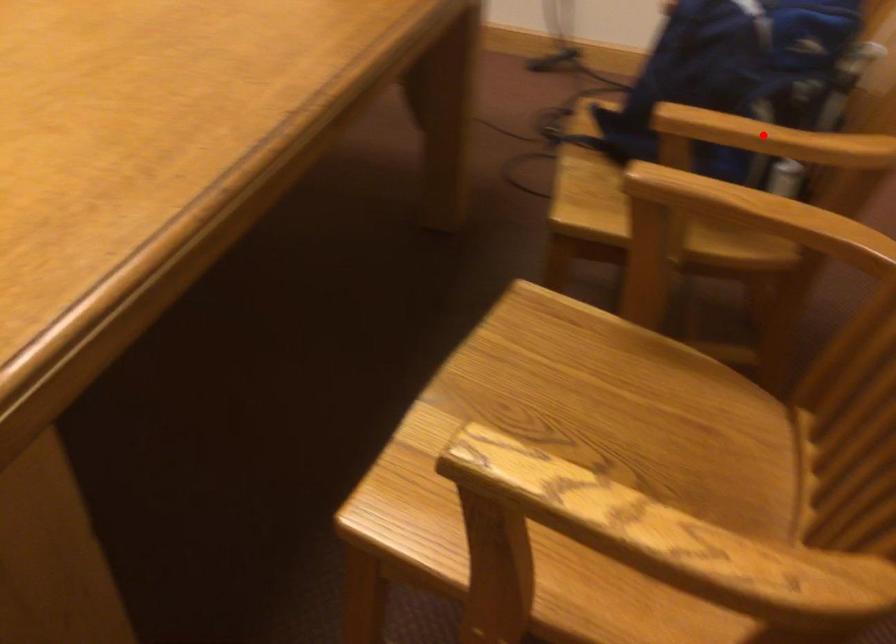
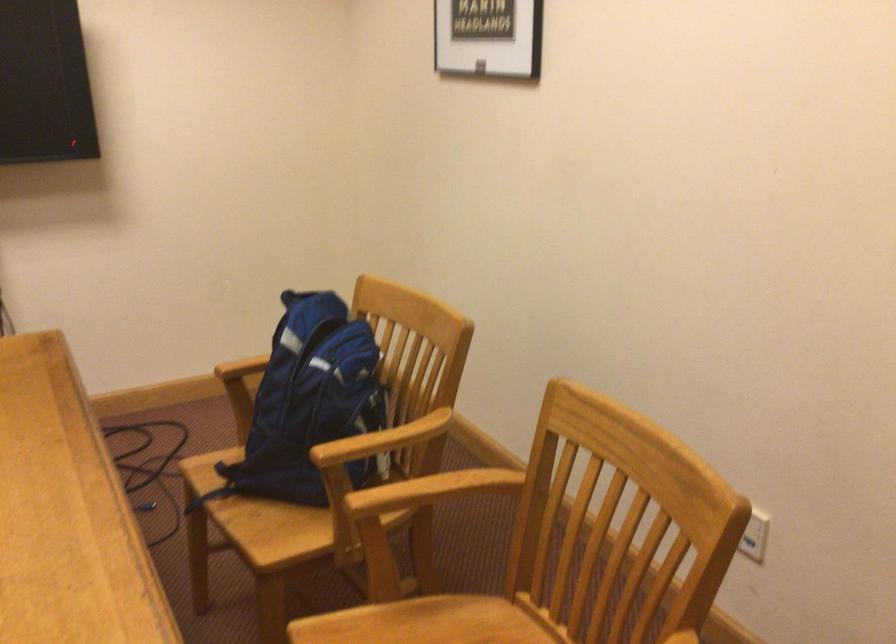
Find the pixel in the second image that matches the highlighted location in the first image.

(383, 440)